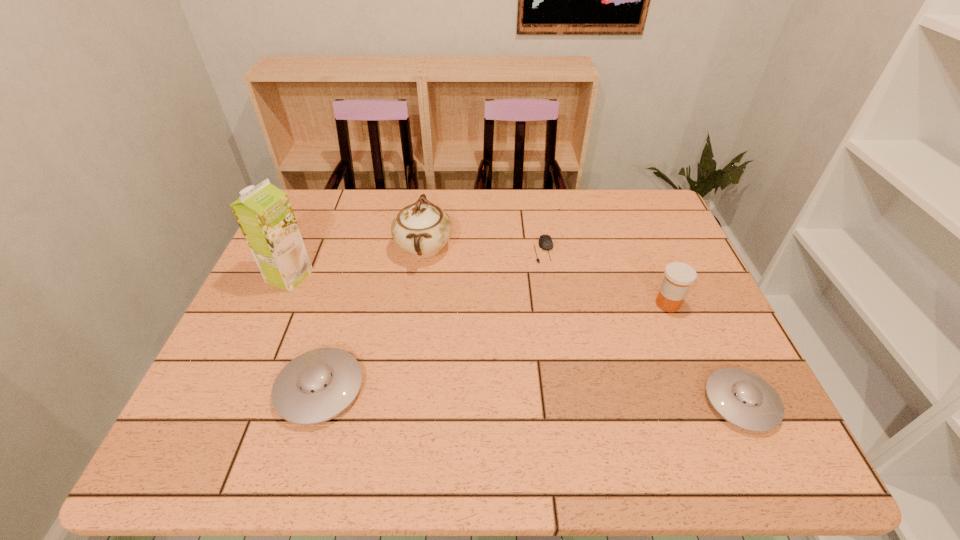
This screenshot has width=960, height=540. I want to click on free space between the fourth object from left to right and the right saucer, so click(642, 326).

You are a GUI agent. You are given a task and a screenshot of the screen. Output one action in this format:
    pyautogui.click(x=<x>, y=<y>)
    Task: Click on the blank region between the third shortest object and the tallest object
    The height and width of the screenshot is (540, 960).
    Given the screenshot: What is the action you would take?
    pyautogui.click(x=304, y=333)

Locate an element on the screen. The image size is (960, 540). object that can be found as the fifth closest to the shortest object is located at coordinates (264, 213).

Identify which object is located as the second nearest to the left saucer. Please provide its 2D coordinates. Your answer should be formatted as a tuple, i.e. [(x, y)], where the tuple contains the x and y coordinates of a point satisfying the conditions above.

[(422, 229)]

Where is `vacant area in the image that satisfies the following two spatial constraints: 1. on the back side of the second tallest object; 2. on the left side of the taller saucer`? This screenshot has height=540, width=960. vacant area in the image that satisfies the following two spatial constraints: 1. on the back side of the second tallest object; 2. on the left side of the taller saucer is located at coordinates (362, 248).

At what (x,y) coordinates should I click in order to perform the action: click on vacant space that satisfies the following two spatial constraints: 1. on the label of the right saucer; 2. on the left side of the fourth farthest object. Please return your answer as a coordinate pair (x, y). This screenshot has width=960, height=540. Looking at the image, I should click on (708, 402).

Find the location of a particular element. The width and height of the screenshot is (960, 540). vacant region that satisfies the following two spatial constraints: 1. on the back side of the chinaware; 2. on the left side of the taller saucer is located at coordinates (362, 248).

The image size is (960, 540). I want to click on free location that satisfies the following two spatial constraints: 1. on the front side of the soya milk; 2. on the left side of the shorter saucer, so coord(233,402).